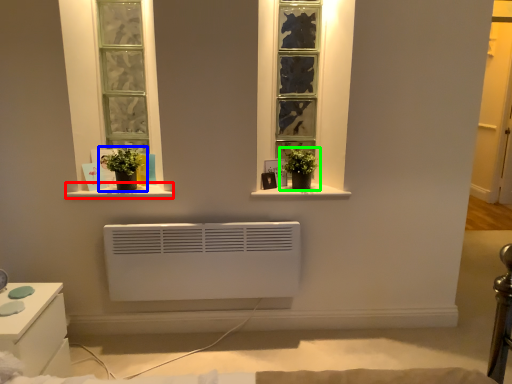
Question: Which is farther away from window sill (highlighted by a red box)? houseplant (highlighted by a blue box) or houseplant (highlighted by a green box)?

Choices:
 (A) houseplant
 (B) houseplant

Answer: (B)